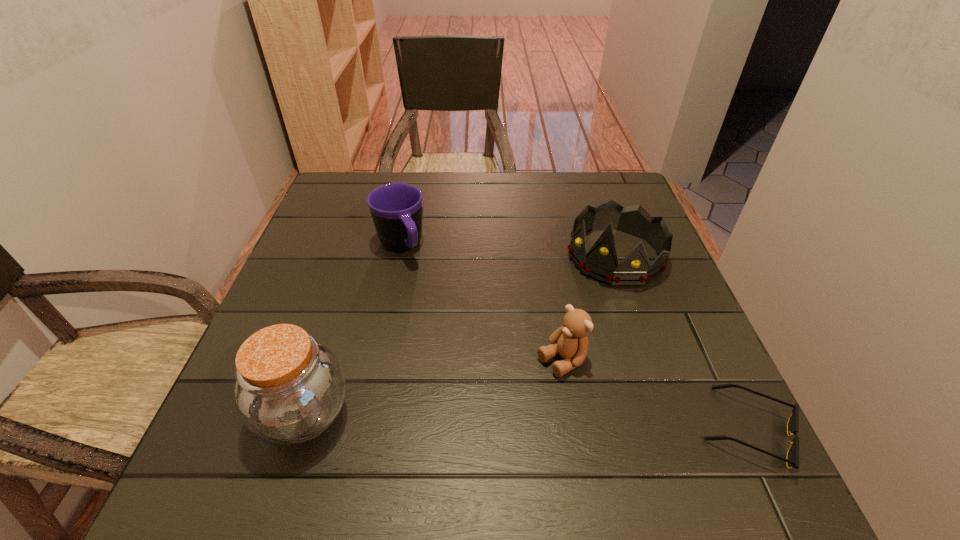
Find the location of `vacant space on the desktop that is between the jar and the sunglasses and is positioned at the front of the tiara with jewels`. vacant space on the desktop that is between the jar and the sunglasses and is positioned at the front of the tiara with jewels is located at coordinates pyautogui.click(x=497, y=421).

Locate an element on the screen. Image resolution: width=960 pixels, height=540 pixels. free space on the desktop that is between the jar and the sunglasses and is positioned on the front-facing side of the third object from right to left is located at coordinates (468, 420).

Find the location of `free spot on the desktop that is between the jar and the sunglasses and is positioned with the handle on the side of the mug`. free spot on the desktop that is between the jar and the sunglasses and is positioned with the handle on the side of the mug is located at coordinates (509, 421).